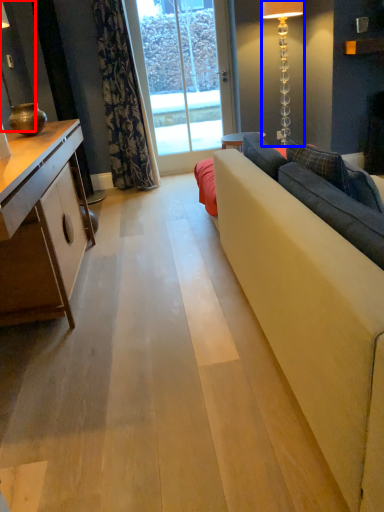
Question: Which object appears farthest to the camera in this image, lamp (highlighted by a red box) or lamp (highlighted by a blue box)?

Choices:
 (A) lamp
 (B) lamp

Answer: (B)